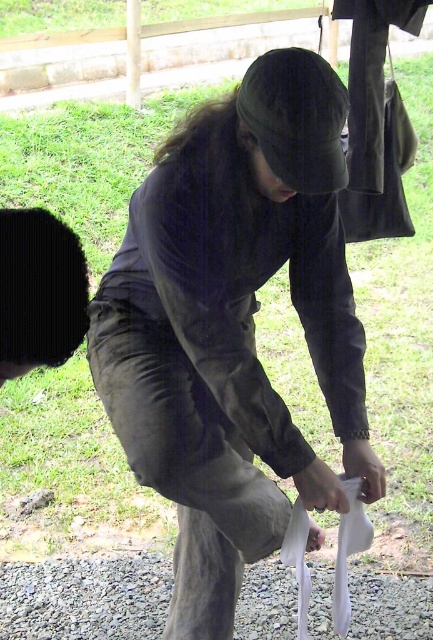
Question: Which object appears closest to the camera in this image?

Choices:
 (A) gray gravel at lower center
 (B) dark gray fabric at center

Answer: (B)

Question: Which point is closer to the camera?

Choices:
 (A) (316, 88)
 (B) (142, 572)

Answer: (A)

Question: Is the position of dark gray fabric at center less distant than that of gray gravel at lower center?

Choices:
 (A) no
 (B) yes

Answer: (B)

Question: Does dark gray fabric at center lie in front of gray gravel at lower center?

Choices:
 (A) no
 (B) yes

Answer: (B)

Question: Which point appears farthest from the camera in this image?

Choices:
 (A) (90, 632)
 (B) (281, 509)

Answer: (A)

Question: Can you confirm if dark gray fabric at center is wider than gray gravel at lower center?

Choices:
 (A) yes
 (B) no

Answer: (A)